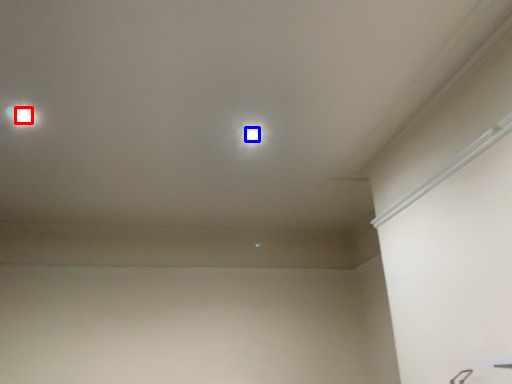
Question: Among these objects, which one is nearest to the camera, dot (highlighted by a red box) or dot (highlighted by a blue box)?

Choices:
 (A) dot
 (B) dot

Answer: (A)